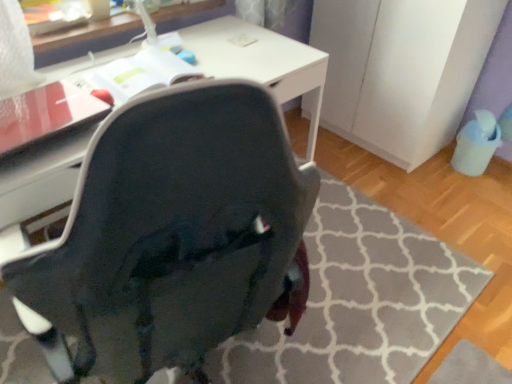
Question: Is point (134, 372) positioned closer to the camera than point (387, 135)?

Choices:
 (A) farther
 (B) closer

Answer: (B)

Question: In terms of size, does matte black chair at center appear bigger or smaller than white matte file cabinet at right?

Choices:
 (A) small
 (B) big

Answer: (A)

Question: Considering the real-world distances, which object is farthest from the white matte file cabinet at right?

Choices:
 (A) matte black chair at center
 (B) white glossy table at upper center

Answer: (A)

Question: Which is nearer to the white glossy table at upper center?

Choices:
 (A) matte black chair at center
 (B) white matte file cabinet at right

Answer: (B)